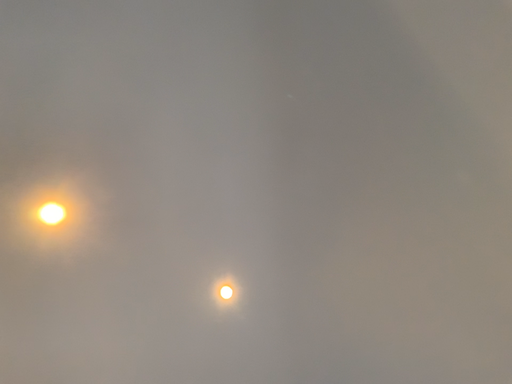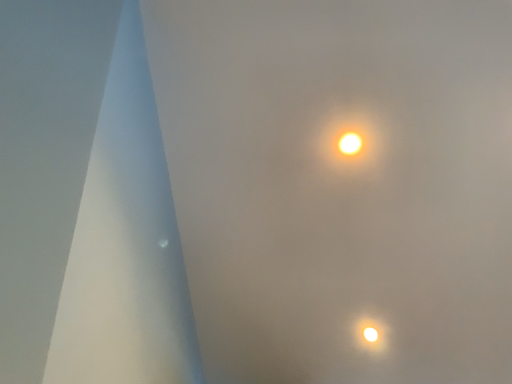
Question: Which way did the camera rotate in the video?

Choices:
 (A) rotated right
 (B) rotated left

Answer: (B)